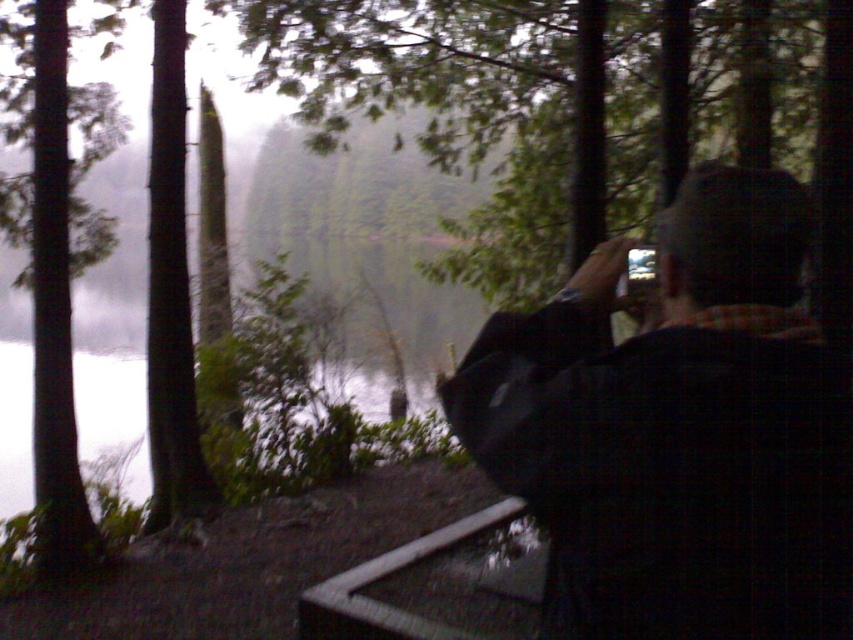
Is dark fabric jacket at right above green matte tree at left?

No, dark fabric jacket at right is not above green matte tree at left.

Where is `dark fabric jacket at right`? Image resolution: width=853 pixels, height=640 pixels. dark fabric jacket at right is located at coordinates (677, 432).